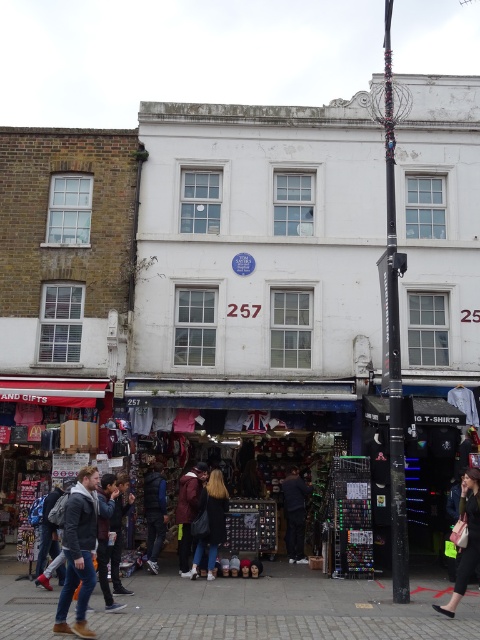
Question: Does dark brown leather jacket at center have a greater width compared to matte black jacket at lower right?

Choices:
 (A) yes
 (B) no

Answer: (B)

Question: Which of the following is the closest to the observer?

Choices:
 (A) (216, 480)
 (B) (397, 552)
 (C) (463, 568)

Answer: (C)

Question: Which object is farther from the camera taking this photo?

Choices:
 (A) matte black jacket at lower right
 (B) dark blue jeans at center

Answer: (B)

Question: Is dark brown leather jacket at center to the left of dark blue denim jacket at lower left from the viewer's perspective?

Choices:
 (A) yes
 (B) no

Answer: (B)

Question: Which of the following is the closest to the observer?

Choices:
 (A) gray leather jacket at lower left
 (B) black textured pole at center-right
 (C) dark blue jeans at center

Answer: (A)

Question: Considering the relative positions of dark blue denim jacket at lower left and maroon fabric jacket at center in the image provided, where is dark blue denim jacket at lower left located with respect to maroon fabric jacket at center?

Choices:
 (A) above
 (B) below

Answer: (B)